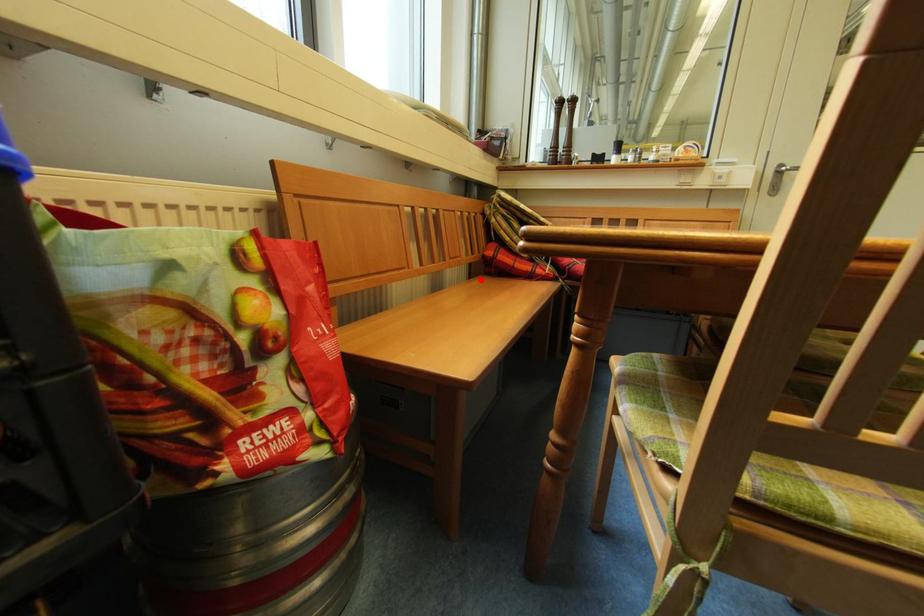
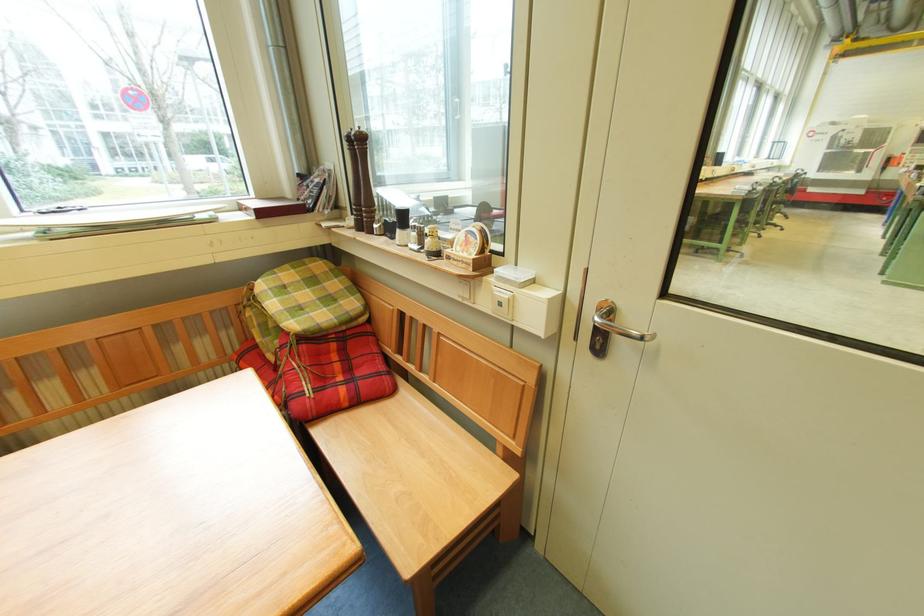
Question: I am providing you with two images of the same scene from different viewpoints. A red point is marked on the first image. Can you still see the location of the red point in image 2?

Choices:
 (A) Yes
 (B) No

Answer: (B)